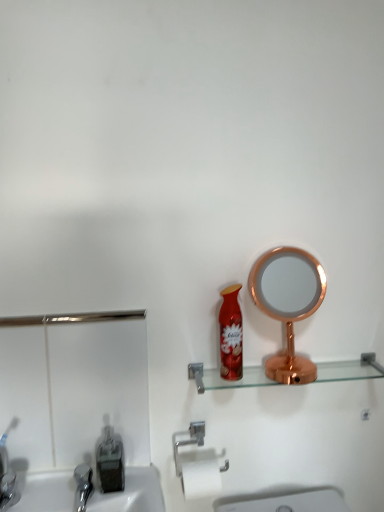
Question: Can you confirm if transparent glass shelf at center is taller than brushed metal sink at lower left?

Choices:
 (A) yes
 (B) no

Answer: (B)

Question: Are transparent glass shelf at center and brushed metal sink at lower left far apart?

Choices:
 (A) no
 (B) yes

Answer: (A)

Question: Is transparent glass shelf at center not within brushed metal sink at lower left?

Choices:
 (A) yes
 (B) no

Answer: (A)

Question: Considering the relative sizes of transparent glass shelf at center and brushed metal sink at lower left in the image provided, is transparent glass shelf at center shorter than brushed metal sink at lower left?

Choices:
 (A) no
 (B) yes

Answer: (B)

Question: Is transparent glass shelf at center next to brushed metal sink at lower left?

Choices:
 (A) no
 (B) yes

Answer: (A)

Question: From a real-world perspective, is silver metallic towel bar at lower center positioned above or below translucent plastic soap dispenser at lower left?

Choices:
 (A) below
 (B) above

Answer: (A)

Question: Does point (193, 466) appear closer or farther from the camera than point (119, 458)?

Choices:
 (A) farther
 (B) closer

Answer: (B)

Question: Relative to translucent plastic soap dispenser at lower left, is silver metallic towel bar at lower center in front or behind?

Choices:
 (A) front
 (B) behind

Answer: (B)

Question: Considering the positions of silver metallic towel bar at lower center and translucent plastic soap dispenser at lower left in the image, is silver metallic towel bar at lower center bigger or smaller than translucent plastic soap dispenser at lower left?

Choices:
 (A) small
 (B) big

Answer: (B)

Question: Does point (231, 318) appear closer or farther from the camera than point (205, 378)?

Choices:
 (A) closer
 (B) farther

Answer: (A)

Question: Do you think shiny red spray can at center is within transparent glass shelf at center, or outside of it?

Choices:
 (A) inside
 (B) outside

Answer: (B)

Question: From a real-world perspective, is shiny red spray can at center positioned above or below transparent glass shelf at center?

Choices:
 (A) above
 (B) below

Answer: (A)

Question: In terms of height, does shiny red spray can at center look taller or shorter compared to transparent glass shelf at center?

Choices:
 (A) tall
 (B) short

Answer: (A)

Question: From a real-world perspective, is brushed metal sink at lower left positioned above or below transparent glass shelf at center?

Choices:
 (A) above
 (B) below

Answer: (B)

Question: In terms of size, does brushed metal sink at lower left appear bigger or smaller than transparent glass shelf at center?

Choices:
 (A) small
 (B) big

Answer: (B)